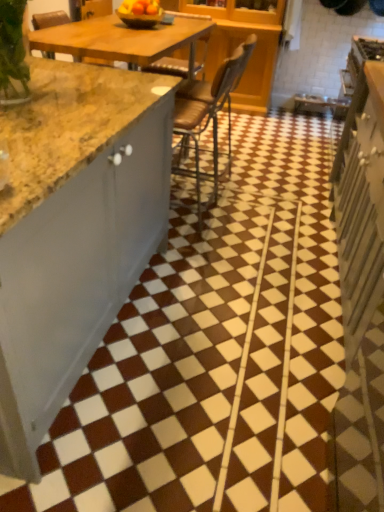
Identify the location of vacant space to the right of brown leather chair at center. The height and width of the screenshot is (512, 384). (268, 185).